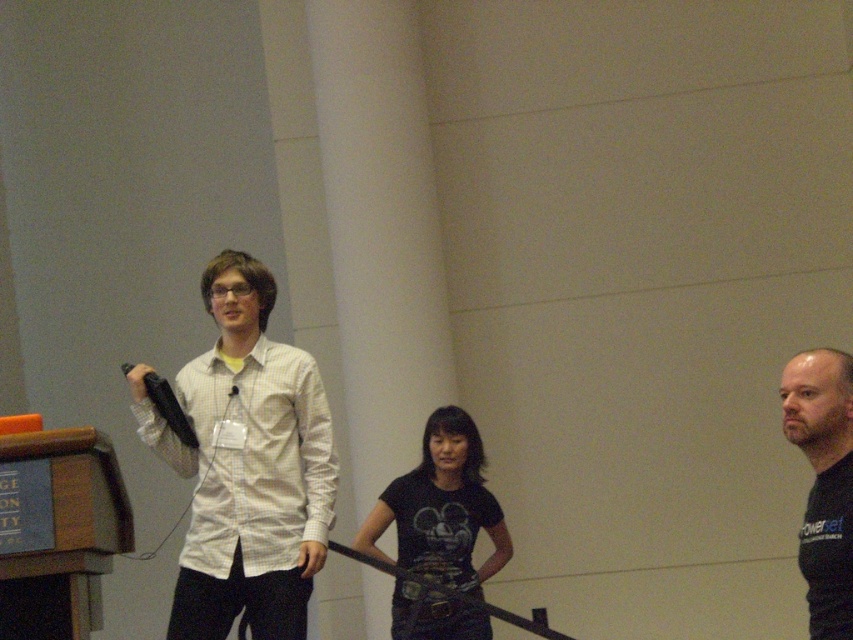
Question: Which is farther from the black matte shirt at center?

Choices:
 (A) black matte shirt at right
 (B) black matte t-shirt at center

Answer: (A)

Question: Among these objects, which one is farthest from the camera?

Choices:
 (A) black matte shirt at right
 (B) black matte shirt at center
 (C) black matte t-shirt at center

Answer: (C)

Question: Does black matte t-shirt at center lie behind black matte shirt at right?

Choices:
 (A) no
 (B) yes

Answer: (B)

Question: Does black matte shirt at center lie behind black matte shirt at right?

Choices:
 (A) yes
 (B) no

Answer: (A)

Question: Among these objects, which one is farthest from the camera?

Choices:
 (A) black matte shirt at center
 (B) black matte shirt at right
 (C) black matte t-shirt at center

Answer: (C)

Question: Does black matte shirt at center appear over black matte t-shirt at center?

Choices:
 (A) no
 (B) yes

Answer: (B)